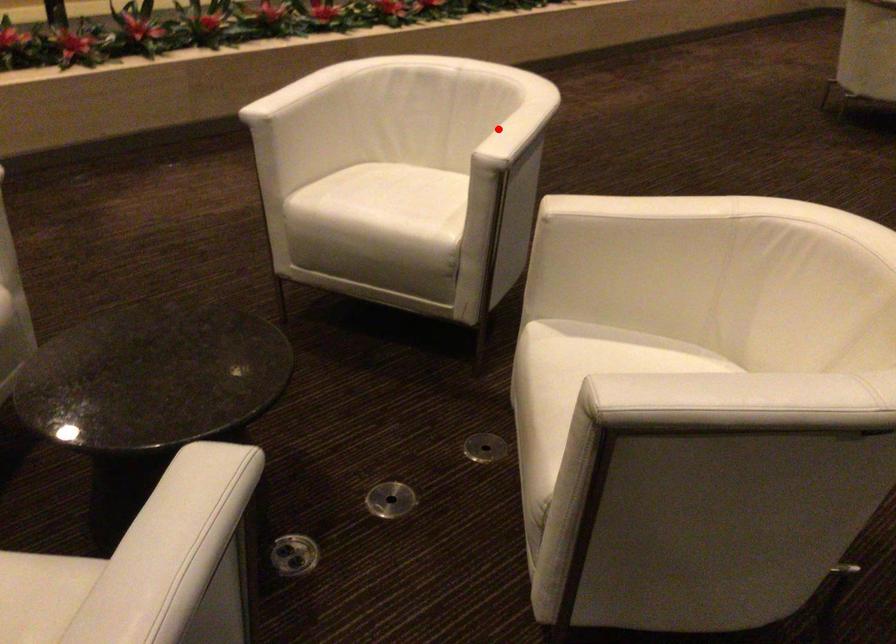
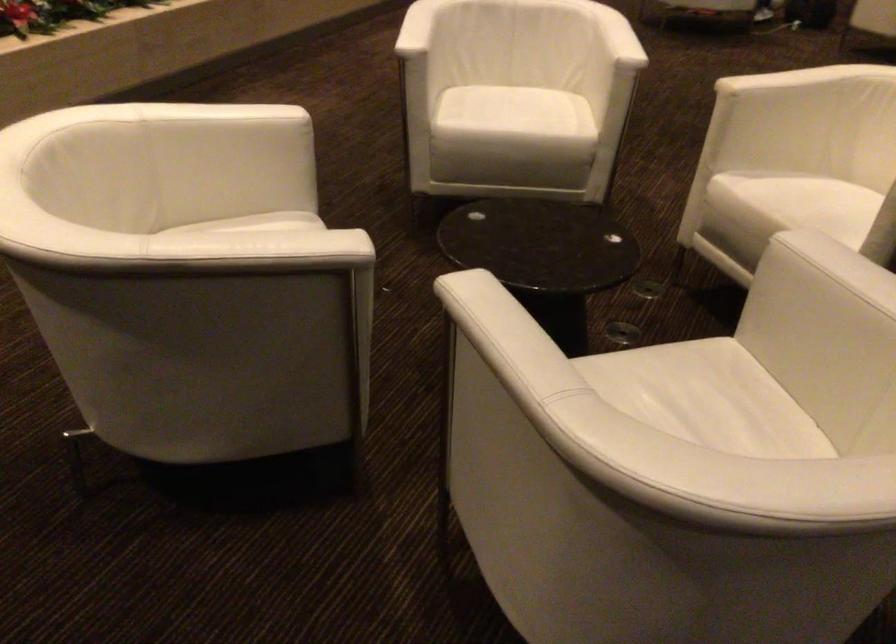
Question: I am providing you with two images of the same scene from different viewpoints. A red point is shown in image1. For the corresponding object point in image2, is it positioned nearer or farther from the camera?

Choices:
 (A) Nearer
 (B) Farther

Answer: (B)